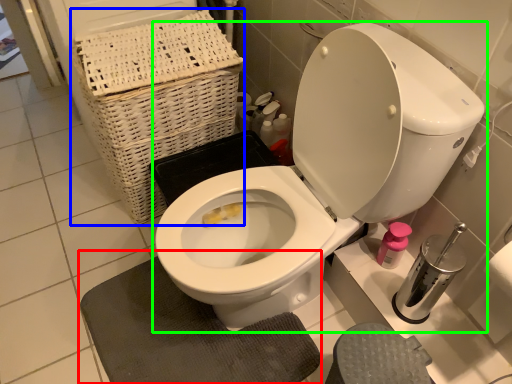
Question: Which object is the farthest from bath mat (highlighted by a red box)? Choose among these: basket (highlighted by a blue box) or toilet (highlighted by a green box).

Choices:
 (A) basket
 (B) toilet

Answer: (A)